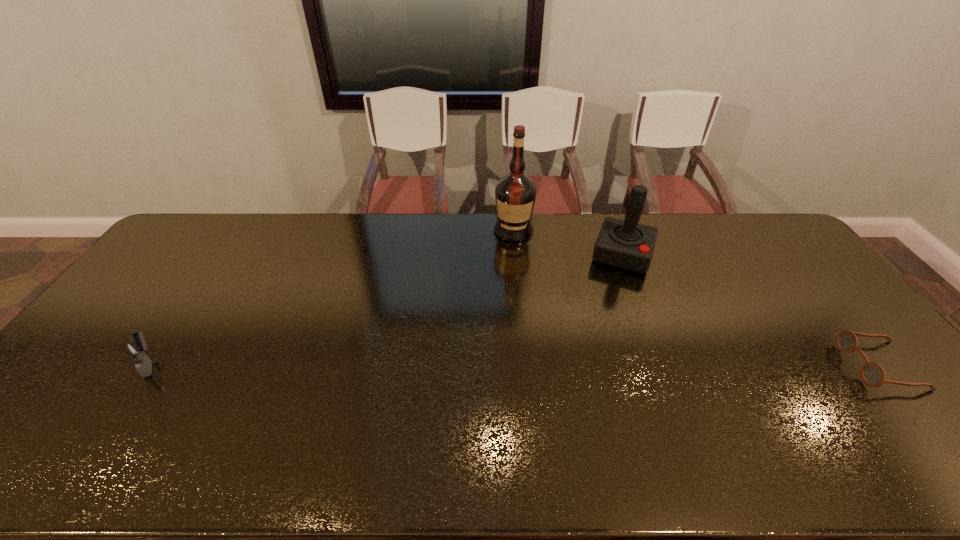
At what (x,y) coordinates should I click in order to perform the action: click on vacant region located on the front-facing side of the rightmost object. Please return your answer as a coordinate pair (x, y). The height and width of the screenshot is (540, 960). Looking at the image, I should click on (743, 366).

In order to click on vacant space located on the front-facing side of the rightmost object in this screenshot , I will do `click(766, 366)`.

I want to click on vacant area situated on the base of the third object from left to right, so click(591, 358).

At what (x,y) coordinates should I click in order to perform the action: click on vacant position located on the base of the third object from left to right. Please return your answer as a coordinate pair (x, y). Looking at the image, I should click on (590, 361).

The image size is (960, 540). Identify the location of free space located 0.340m on the base of the third object from left to right. (594, 350).

Image resolution: width=960 pixels, height=540 pixels. In order to click on vacant space located on the surface of the liquor in this screenshot , I will do `click(511, 253)`.

You are a GUI agent. You are given a task and a screenshot of the screen. Output one action in this format:
    pyautogui.click(x=<x>, y=<y>)
    Task: Click on the vacant space located on the surface of the liquor
    The height and width of the screenshot is (540, 960).
    Given the screenshot: What is the action you would take?
    pyautogui.click(x=509, y=270)

Locate an element on the screen. vacant region located on the surface of the liquor is located at coordinates (512, 251).

Locate an element on the screen. joystick present at the far edge is located at coordinates (626, 244).

At what (x,y) coordinates should I click in order to perform the action: click on liquor located at the far edge. Please return your answer as a coordinate pair (x, y). The height and width of the screenshot is (540, 960). Looking at the image, I should click on (515, 194).